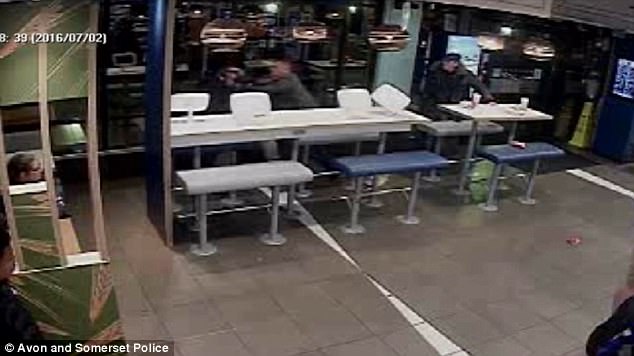
Find the location of a particular element. Image resolution: width=634 pixels, height=356 pixels. bench is located at coordinates (242, 176), (392, 164), (522, 145).